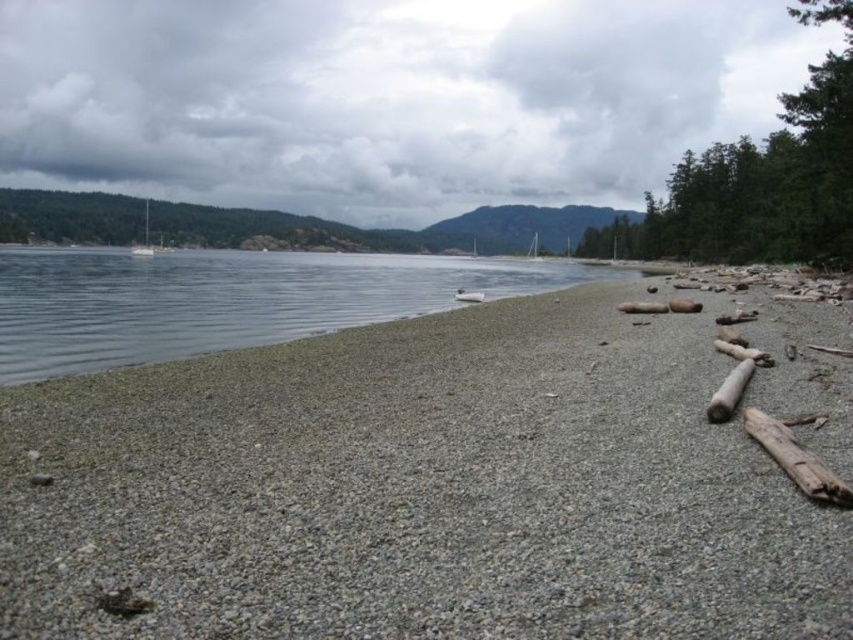
Question: Is gray gravelly sand at lower left thinner than clear water at center?

Choices:
 (A) yes
 (B) no

Answer: (A)

Question: Which object appears farthest from the camera in this image?

Choices:
 (A) clear water at center
 (B) gray gravelly sand at lower left

Answer: (A)

Question: Does gray gravelly sand at lower left have a larger size compared to clear water at center?

Choices:
 (A) no
 (B) yes

Answer: (A)

Question: Which point is closer to the camera taking this photo?

Choices:
 (A) (358, 392)
 (B) (140, 326)

Answer: (A)

Question: Does gray gravelly sand at lower left appear over clear water at center?

Choices:
 (A) yes
 (B) no

Answer: (B)